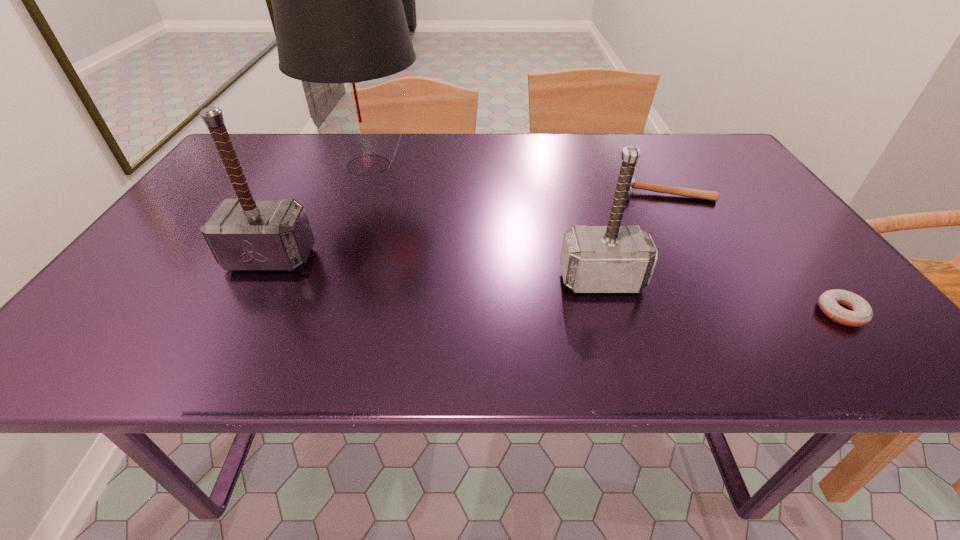
Find the location of `empty space between the tallest object and the rightmost hammer`. empty space between the tallest object and the rightmost hammer is located at coordinates (516, 178).

Where is `vacant space in between the tallest object and the fourth object from left to right`? This screenshot has height=540, width=960. vacant space in between the tallest object and the fourth object from left to right is located at coordinates (516, 178).

The height and width of the screenshot is (540, 960). What are the coordinates of `vacant point located between the shortest hammer and the rightmost object` in the screenshot? It's located at (753, 252).

The image size is (960, 540). In order to click on vacant point located between the leftmost hammer and the third object from right to left in this screenshot , I will do `click(436, 269)`.

Image resolution: width=960 pixels, height=540 pixels. I want to click on free space between the third object from right to left and the leftmost hammer, so 436,269.

This screenshot has height=540, width=960. Identify the location of empty location between the leftmost hammer and the fourth object from left to right. (468, 225).

This screenshot has height=540, width=960. Identify the location of free area in between the doughnut and the leftmost hammer. (556, 286).

I want to click on free spot between the leftmost hammer and the rightmost object, so click(556, 286).

At what (x,y) coordinates should I click in order to perform the action: click on unoccupied area between the leftmost hammer and the rightmost object. Please return your answer as a coordinate pair (x, y). Looking at the image, I should click on (556, 286).

Select which object appears as the closest to the lampshade. Please provide its 2D coordinates. Your answer should be formatted as a tuple, i.e. [(x, y)], where the tuple contains the x and y coordinates of a point satisfying the conditions above.

[(245, 234)]